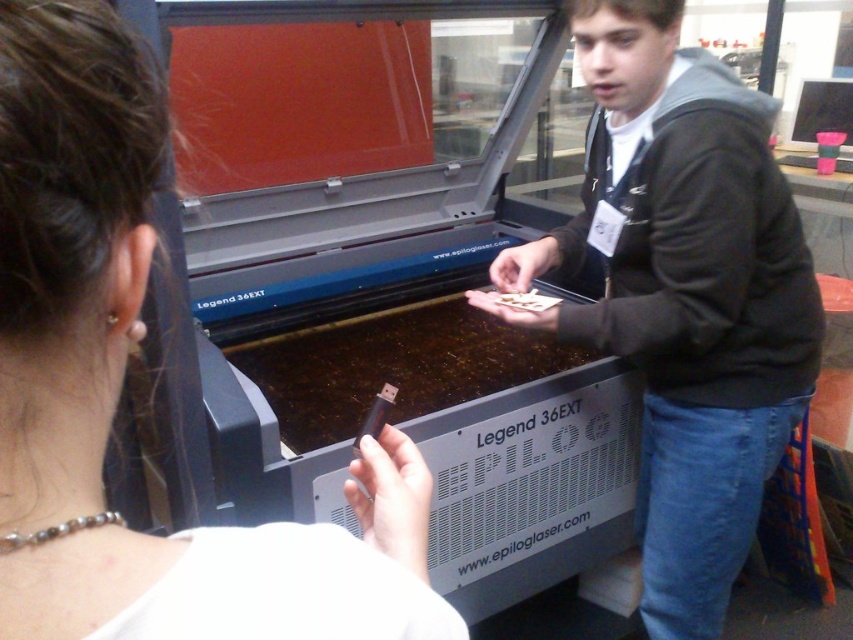
Does matte black usb drive at center appear under dark gray hoodie at center?

Yes.

Does matte black usb drive at center have a smaller size compared to dark gray hoodie at center?

Yes, matte black usb drive at center is smaller than dark gray hoodie at center.

Who is more distant from viewer, (363, 497) or (732, 397)?

Positioned behind is point (732, 397).

You are a GUI agent. You are given a task and a screenshot of the screen. Output one action in this format:
    pyautogui.click(x=<x>, y=<y>)
    Task: Click on the matte black usb drive at center
    The image size is (853, 640).
    Given the screenshot: What is the action you would take?
    (122, 380)